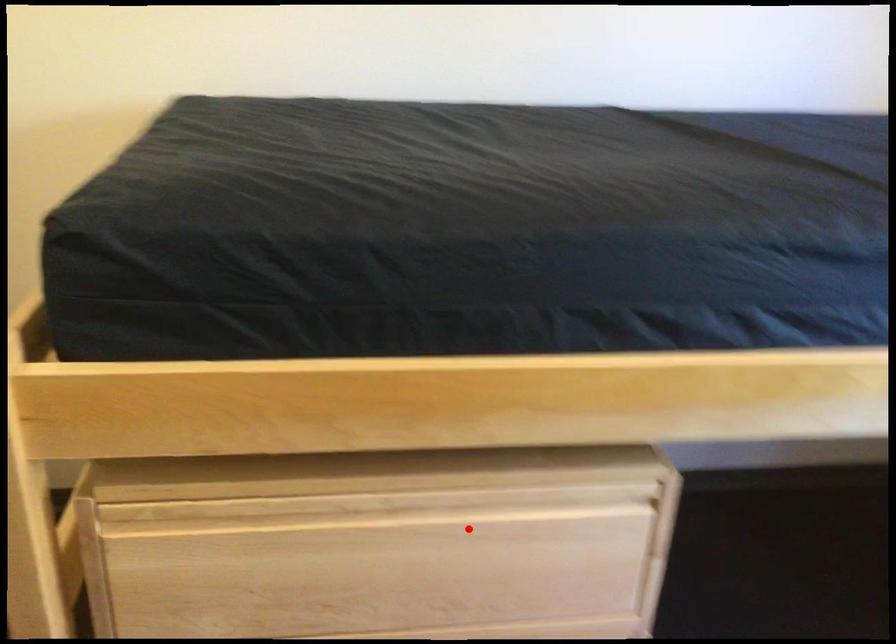
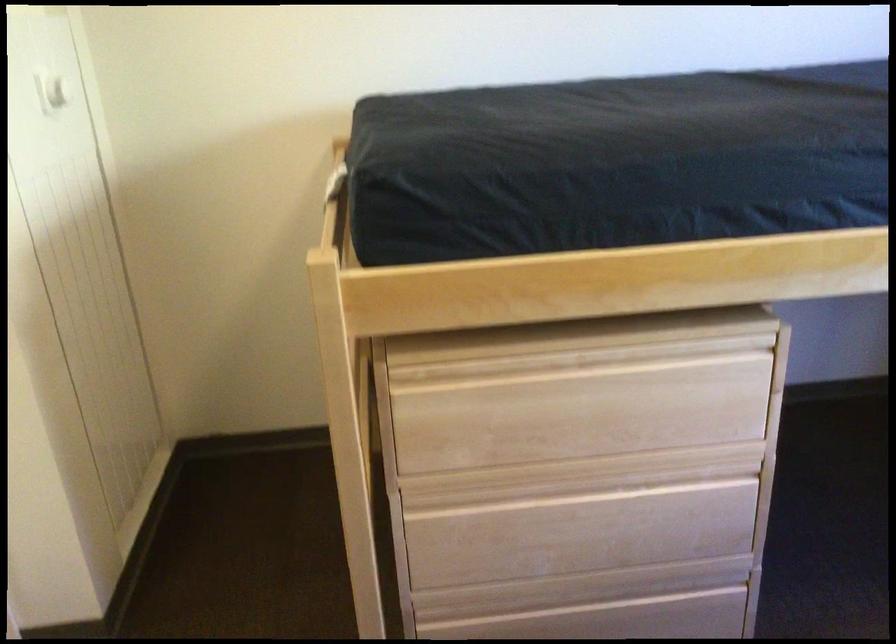
In the second image, find the point that corresponds to the highlighted location in the first image.

(642, 377)